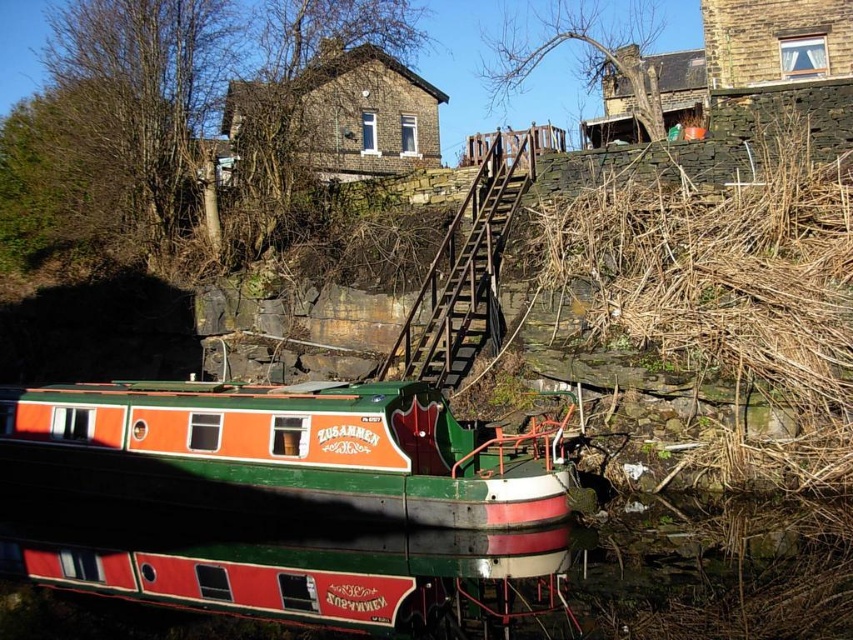
From the picture: You are standing on the wooden stairs at upper center and want to board the green painted wood boat at center. Which direction should you walk to reach the boat?

You should walk downward because the green painted wood boat at center is in front of the wooden stairs at upper center, indicating that the stairs lead down toward the boat.

You are a tour guide explaining the canal scene to visitors. You mention both the green painted wood boat at center and the wooden stairs at upper center. Based on their sizes, which object would you describe as being larger?

The wooden stairs at upper center are larger than the green painted wood boat at center.

You are a delivery drone with a wingspan of 1.2 meters. You need to fly from the green painted wood boat at center to the wooden stairs at upper center. Is there enough space between them for your drone to pass safely?

The distance between the green painted wood boat at center and the wooden stairs at upper center is 8.30 meters. Since your drone has a wingspan of 1.2 meters, there is ample space for it to pass safely between them.